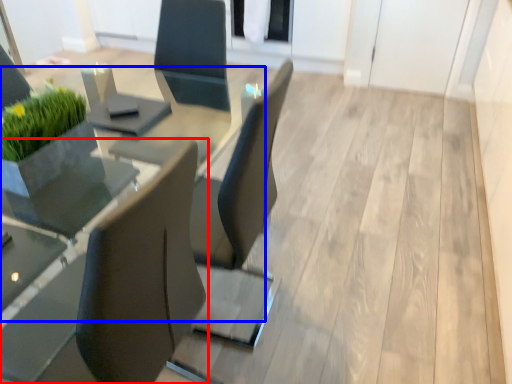
Question: Which of the following is the closest to the observer, chair (highlighted by a red box) or round table (highlighted by a blue box)?

Choices:
 (A) chair
 (B) round table

Answer: (A)